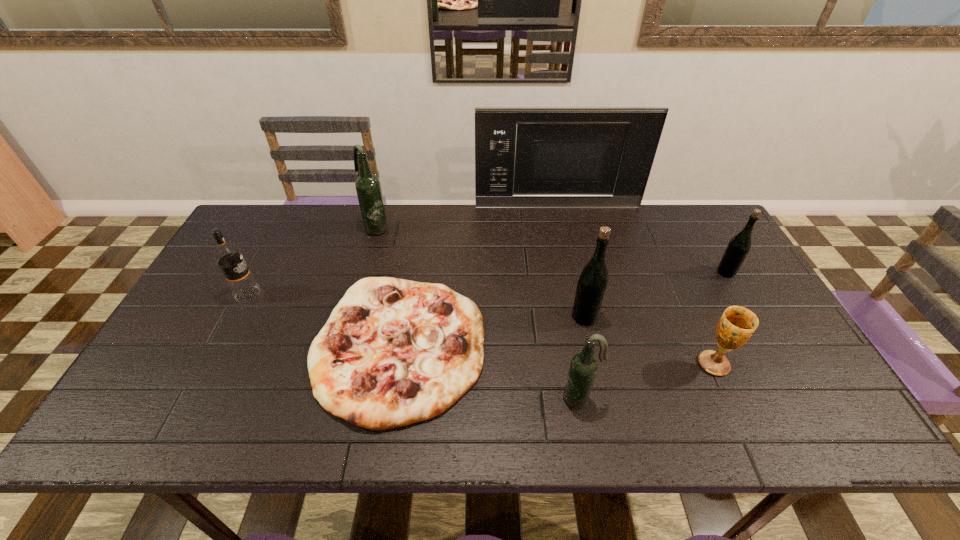
This screenshot has height=540, width=960. What are the coordinates of `free spot between the nearer dark beer bottle and the pizza` in the screenshot? It's located at (490, 373).

Where is `object that is the third closest to the pizza`? Image resolution: width=960 pixels, height=540 pixels. object that is the third closest to the pizza is located at coordinates (368, 188).

You are a GUI agent. You are given a task and a screenshot of the screen. Output one action in this format:
    pyautogui.click(x=<x>, y=<y>)
    Task: Click on the seventh closest object to the vodka
    This screenshot has height=540, width=960.
    Given the screenshot: What is the action you would take?
    pyautogui.click(x=739, y=246)

Locate which beer bottle is the second closest to the bigger dark beer bottle. Please provide its 2D coordinates. Your answer should be formatted as a tuple, i.e. [(x, y)], where the tuple contains the x and y coordinates of a point satisfying the conditions above.

[(583, 367)]

Identify the location of beer bottle identified as the closest to the bigger green beer bottle. The image size is (960, 540). (583, 367).

The image size is (960, 540). In order to click on free space in the image that satisfies the following two spatial constraints: 1. on the label of the vodka; 2. on the right side of the pizza in this screenshot , I will do `click(221, 347)`.

The height and width of the screenshot is (540, 960). Find the location of `free space that satisfies the following two spatial constraints: 1. on the front panel of the dark microwave oven; 2. on the label of the vodka`. free space that satisfies the following two spatial constraints: 1. on the front panel of the dark microwave oven; 2. on the label of the vodka is located at coordinates (576, 295).

Where is `blank space that satisfies the following two spatial constraints: 1. on the front panel of the farther green beer bottle; 2. on the left side of the farthest object`? The image size is (960, 540). blank space that satisfies the following two spatial constraints: 1. on the front panel of the farther green beer bottle; 2. on the left side of the farthest object is located at coordinates (571, 272).

Identify the location of free spot that satisfies the following two spatial constraints: 1. on the back side of the third nearest beer bottle; 2. on the left side of the second nearest beer bottle. This screenshot has height=540, width=960. (575, 272).